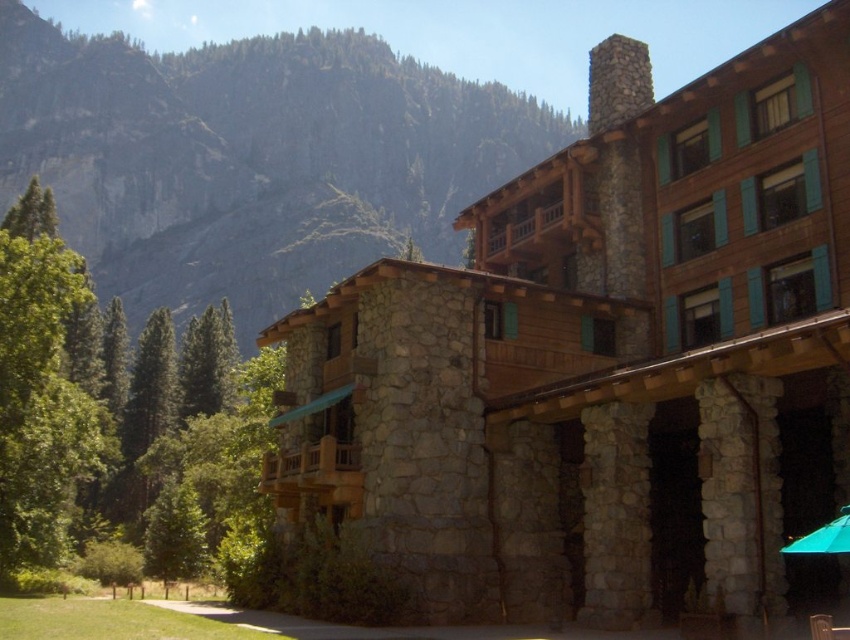
Question: Which of the following is the farthest from the observer?

Choices:
 (A) stone/wooden hotel at center
 (B) rocky cliff at upper left

Answer: (B)

Question: Does rocky cliff at upper left have a larger size compared to transparent nylon umbrella at center?

Choices:
 (A) yes
 (B) no

Answer: (A)

Question: Which point is farther to the camera?

Choices:
 (A) rocky cliff at upper left
 (B) green leafy tree at lower left
 (C) green leafy tree at left
 (D) stone/wooden hotel at center

Answer: (A)

Question: Does rocky cliff at upper left have a smaller size compared to green leafy tree at lower left?

Choices:
 (A) no
 (B) yes

Answer: (A)

Question: Does rocky cliff at upper left have a lesser width compared to transparent nylon umbrella at center?

Choices:
 (A) no
 (B) yes

Answer: (A)

Question: Which object is positioned closest to the wooden chair at lower right?

Choices:
 (A) rocky cliff at upper left
 (B) stone/wooden hotel at center
 (C) green leafy tree at left

Answer: (B)